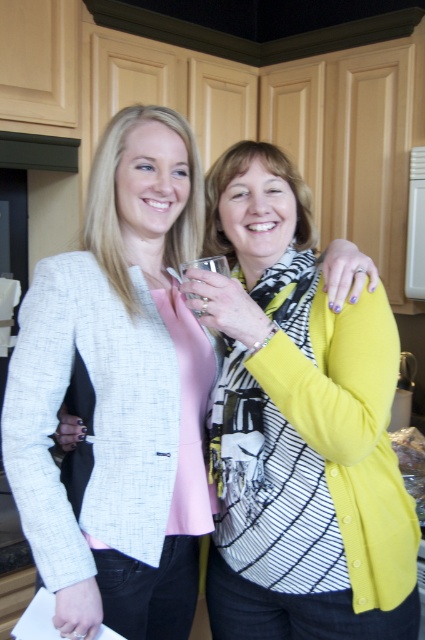
You are a photographer setting up a shoot in the kitchen scene. You need to position a light source to the right of both the matte yellow cardigan at center and the clear glass at center. Is this possible based on their positions?

The matte yellow cardigan at center is to the left of the clear glass at center. Since the photographer wants to place the light source to the right of both objects, it is possible as long as the light is positioned to the right of the clear glass at center, which is already to the right of the matte yellow cardigan at center.

You are standing in the kitchen and want to reach the matte yellow cardigan at center located at point [119,392]. Which woman is closer to this point?

The woman on the right is closer to the matte yellow cardigan at center located at point [119,392] because the description specifies that the matte yellow cardigan at center is at that coordinate, which is closer to her position.